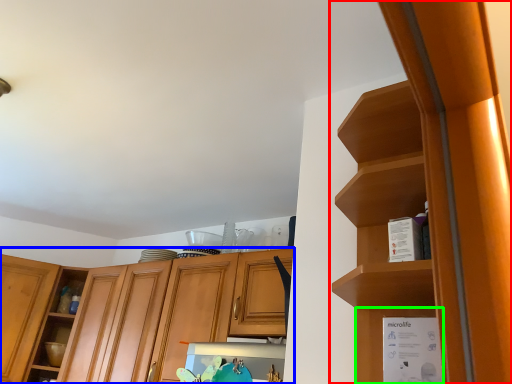
Question: Considering the real-world distances, which object is farthest from cabinetry (highlighted by a red box)? cabinetry (highlighted by a blue box) or cabinet (highlighted by a green box)?

Choices:
 (A) cabinetry
 (B) cabinet

Answer: (A)